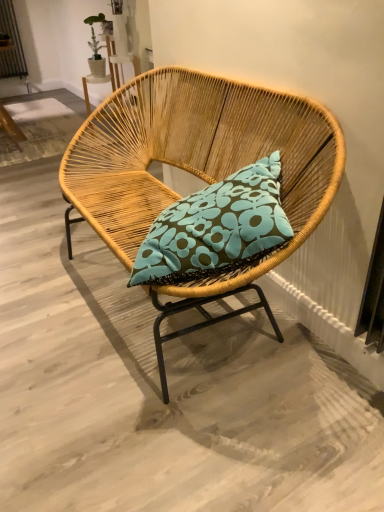
Question: In the image, is teal fabric pillow at center on the left side or the right side of woven wood chair at center?

Choices:
 (A) left
 (B) right

Answer: (B)

Question: From a real-world perspective, relative to woven wood chair at center, is teal fabric pillow at center vertically above or below?

Choices:
 (A) above
 (B) below

Answer: (A)

Question: Does point (279, 231) appear closer or farther from the camera than point (311, 102)?

Choices:
 (A) closer
 (B) farther

Answer: (A)

Question: From their relative heights in the image, would you say woven wood chair at center is taller or shorter than teal fabric pillow at center?

Choices:
 (A) short
 (B) tall

Answer: (B)

Question: Is point (326, 203) positioned closer to the camera than point (284, 228)?

Choices:
 (A) closer
 (B) farther

Answer: (B)

Question: Do you think woven wood chair at center is within teal fabric pillow at center, or outside of it?

Choices:
 (A) outside
 (B) inside

Answer: (A)

Question: Based on their sizes in the image, would you say woven wood chair at center is bigger or smaller than teal fabric pillow at center?

Choices:
 (A) big
 (B) small

Answer: (A)